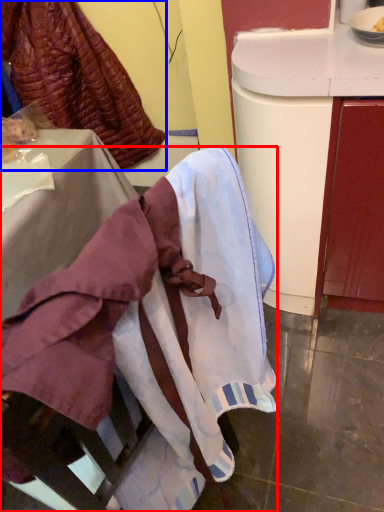
Question: Which of the following is the farthest to the observer, furniture (highlighted by a red box) or leftover (highlighted by a blue box)?

Choices:
 (A) furniture
 (B) leftover

Answer: (B)